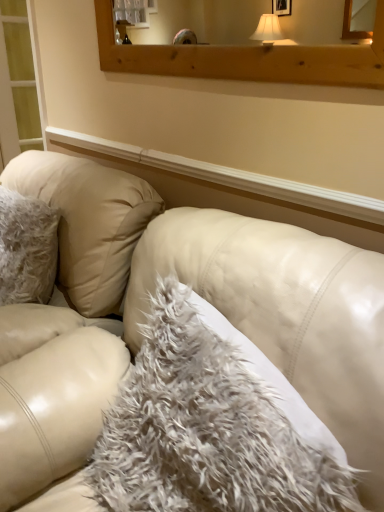
Question: Considering the positions of point (62, 249) and point (233, 68), is point (62, 249) closer or farther from the camera than point (233, 68)?

Choices:
 (A) farther
 (B) closer

Answer: (A)

Question: From a real-world perspective, is white leather couch at center above or below wooden frame at upper center?

Choices:
 (A) below
 (B) above

Answer: (A)

Question: Estimate the real-world distances between objects in this image. Which object is farther from the white leather couch at center?

Choices:
 (A) translucent glass screen door at left
 (B) white fluffy pillow at center
 (C) wooden frame at upper center

Answer: (A)

Question: Considering the real-world distances, which object is farthest from the translucent glass screen door at left?

Choices:
 (A) white fluffy pillow at center
 (B) wooden frame at upper center
 (C) white leather couch at center

Answer: (A)